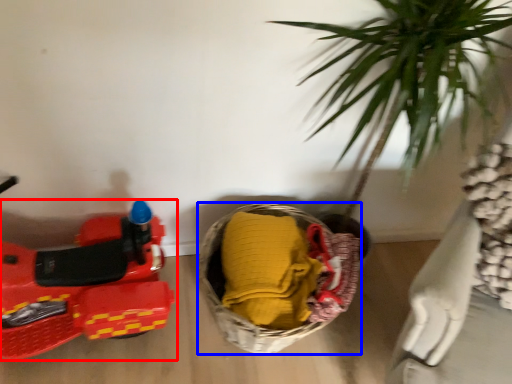
Question: Which object is further to the camera taking this photo, land vehicle (highlighted by a red box) or basket (highlighted by a blue box)?

Choices:
 (A) land vehicle
 (B) basket

Answer: (B)